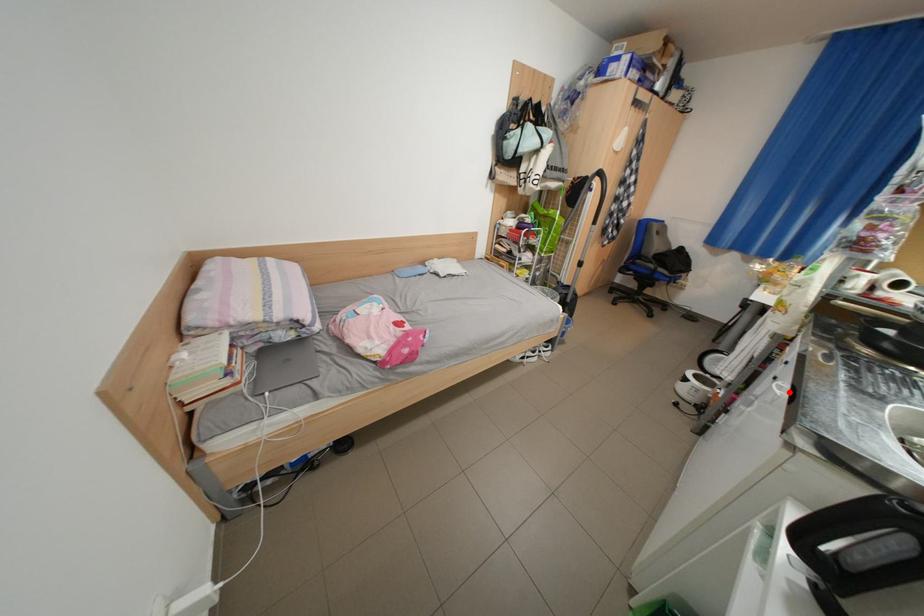
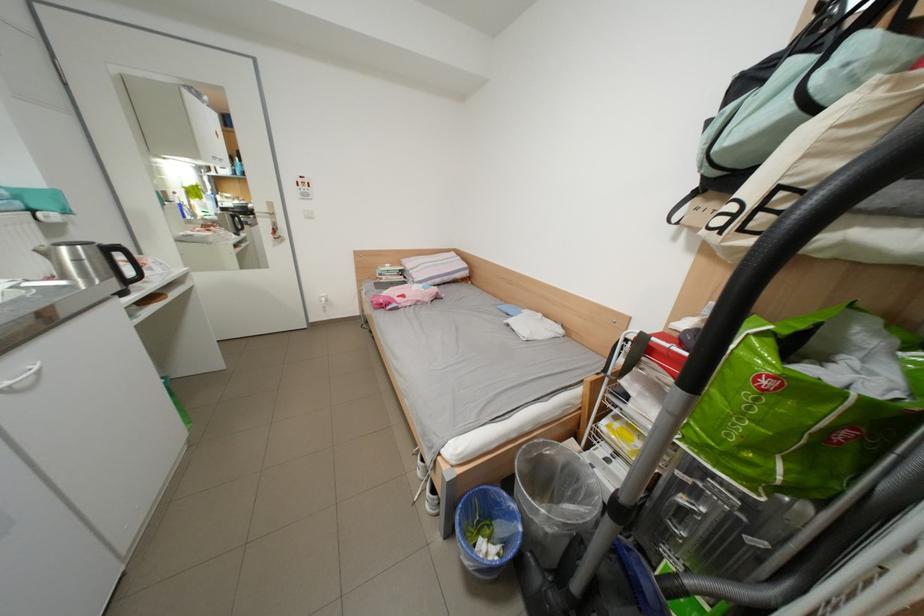
Where in the second image is the point corresponding to the highlighted location from the first image?

(46, 369)